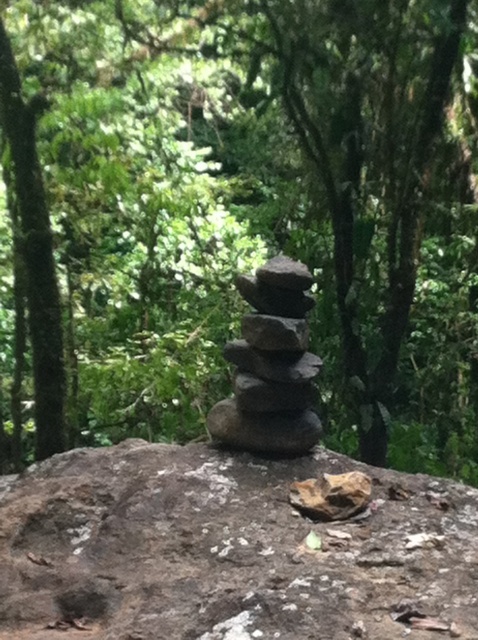
Question: Which object appears closest to the camera in this image?

Choices:
 (A) smooth gray rock at center
 (B) green leafy tree at center

Answer: (A)

Question: Does brown rough rock at center appear over smooth gray rock at center?

Choices:
 (A) yes
 (B) no

Answer: (B)

Question: Is green leafy tree at center smaller than brown rough rock at center?

Choices:
 (A) yes
 (B) no

Answer: (B)

Question: Among these points, which one is nearest to the camera?

Choices:
 (A) (334, 22)
 (B) (4, 516)
 (C) (239, 356)

Answer: (B)

Question: Which object appears closest to the camera in this image?

Choices:
 (A) green leafy tree at center
 (B) smooth gray rock at center

Answer: (B)

Question: Where is brown rough rock at center located in relation to smooth gray rock at center in the image?

Choices:
 (A) above
 (B) below

Answer: (B)